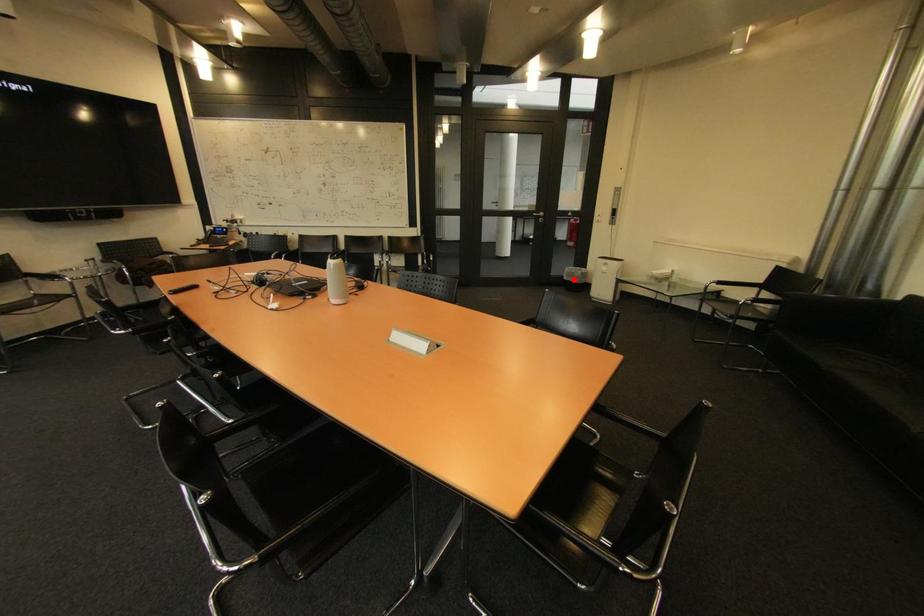
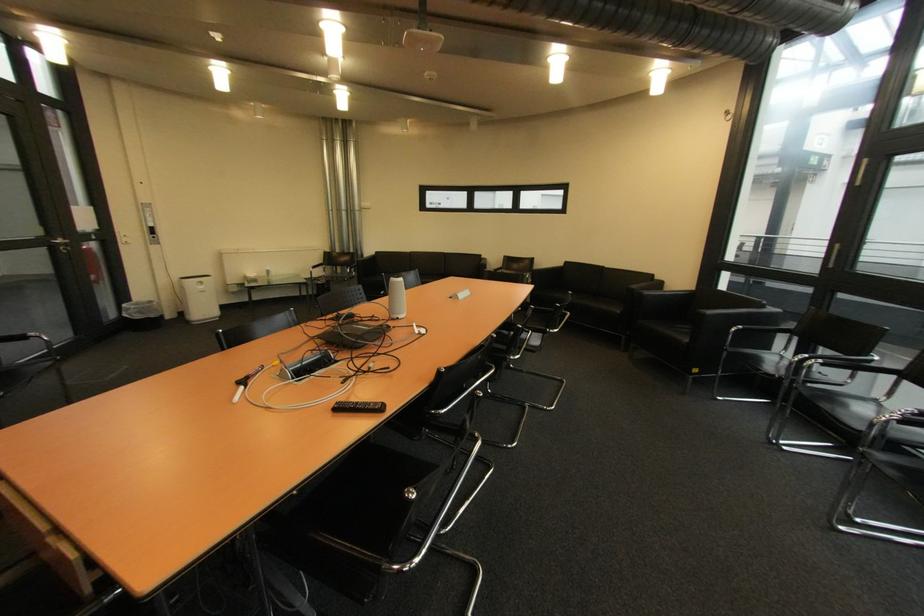
The point at the highlighted location is marked in the first image. Where is the corresponding point in the second image?

(147, 318)